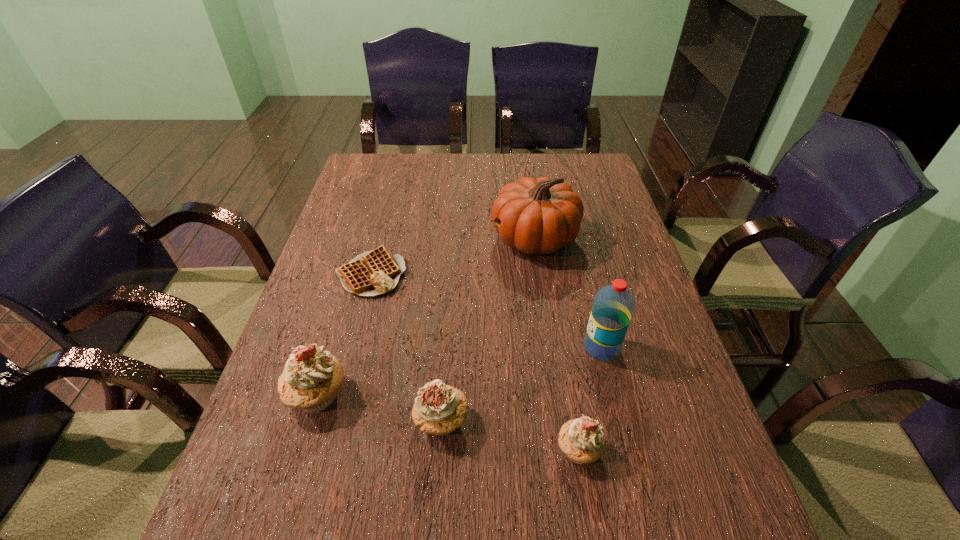
The width and height of the screenshot is (960, 540). In order to click on waffle located at the left edge in this screenshot , I will do `click(375, 272)`.

Locate an element on the screen. The height and width of the screenshot is (540, 960). pumpkin positioned at the right edge is located at coordinates (541, 215).

Locate an element on the screen. water bottle at the right edge is located at coordinates (613, 306).

Where is `blank space at the far edge`? This screenshot has width=960, height=540. blank space at the far edge is located at coordinates (468, 171).

Locate an element on the screen. This screenshot has height=540, width=960. free space at the near edge of the desktop is located at coordinates pyautogui.click(x=612, y=482).

You are a GUI agent. You are given a task and a screenshot of the screen. Output one action in this format:
    pyautogui.click(x=<x>, y=<y>)
    Task: Click on the free space at the left edge
    
    Given the screenshot: What is the action you would take?
    pyautogui.click(x=349, y=218)

You are a GUI agent. You are given a task and a screenshot of the screen. Output one action in this format:
    pyautogui.click(x=<x>, y=<y>)
    Task: Click on the vacant space at the right edge of the desktop
    This screenshot has height=540, width=960.
    Given the screenshot: What is the action you would take?
    pyautogui.click(x=586, y=254)

Identify the location of free space at the far left corner. (370, 185).

At what (x,y) coordinates should I click in order to perform the action: click on vacant space at the far right corner of the desktop. Please return your answer as a coordinate pair (x, y). This screenshot has width=960, height=540. Looking at the image, I should click on (582, 185).

You are a GUI agent. You are given a task and a screenshot of the screen. Output one action in this format:
    pyautogui.click(x=<x>, y=<y>)
    Task: Click on the vacant region between the rightmost cupcake and the third object from left to right
    The image size is (960, 540).
    Given the screenshot: What is the action you would take?
    pyautogui.click(x=510, y=435)